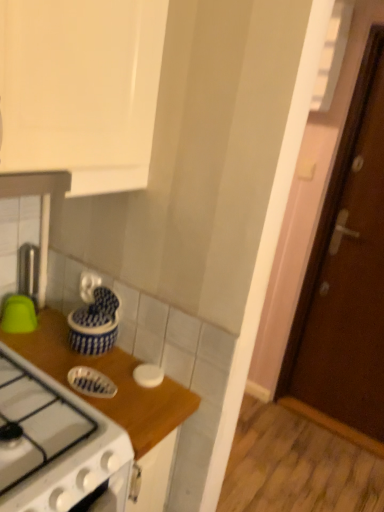
You are a GUI agent. You are given a task and a screenshot of the screen. Output one action in this format:
    pyautogui.click(x=<x>, y=<y>)
    Task: Click on the vacant area located to the right-hand side of blue glossy jar at center, which ranks as the third kitchen appliance in right-to-left order
    
    Given the screenshot: What is the action you would take?
    pyautogui.click(x=140, y=373)